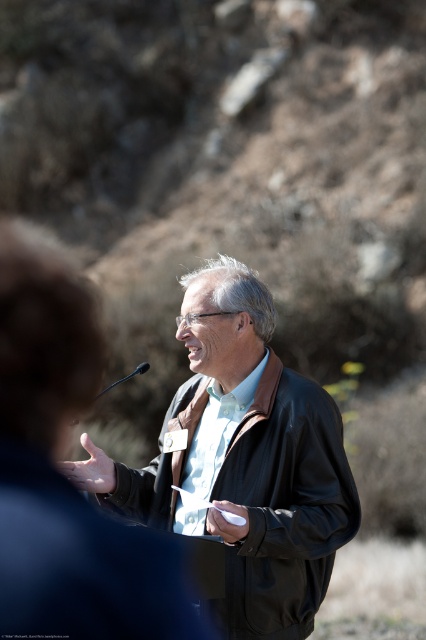
Where is `black leather jacket at center`? black leather jacket at center is located at coordinates pyautogui.click(x=284, y=508).

Is black leather jacket at center to the right of black plastic microphone at center from the viewer's perspective?

Yes, black leather jacket at center is to the right of black plastic microphone at center.

Locate an element on the screen. Image resolution: width=426 pixels, height=640 pixels. black leather jacket at center is located at coordinates (284, 508).